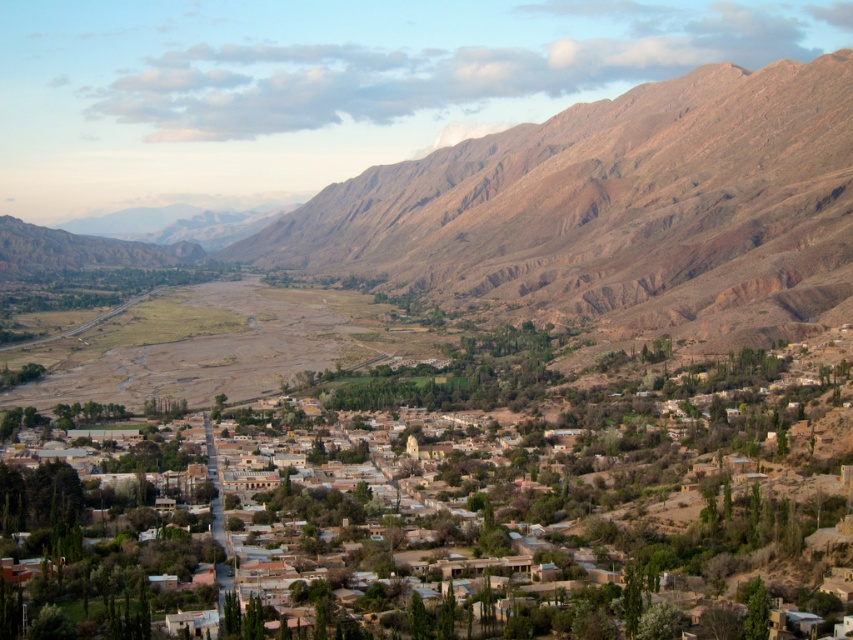
Question: Does brown clay houses at center have a greater width compared to brown rocky mountain at center?

Choices:
 (A) no
 (B) yes

Answer: (A)

Question: Which point appears closest to the camera in this image?

Choices:
 (A) (386, 240)
 (B) (107, 528)

Answer: (B)

Question: Is the position of brown clay houses at center more distant than that of brown rocky mountain at center?

Choices:
 (A) yes
 (B) no

Answer: (B)

Question: Does brown clay houses at center have a lesser width compared to brown rocky mountain at center?

Choices:
 (A) yes
 (B) no

Answer: (A)